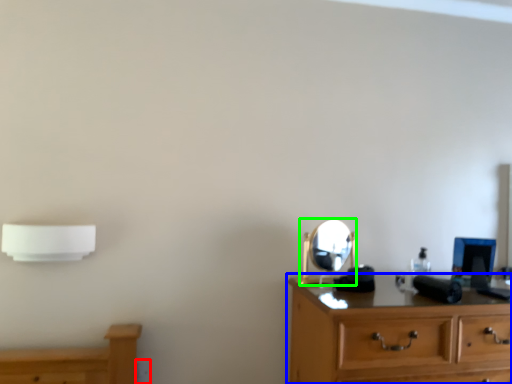
Question: Estimate the real-world distances between objects in this image. Which object is farther from electric outlet (highlighted by a red box), chest of drawers (highlighted by a blue box) or mirror (highlighted by a green box)?

Choices:
 (A) chest of drawers
 (B) mirror

Answer: (A)